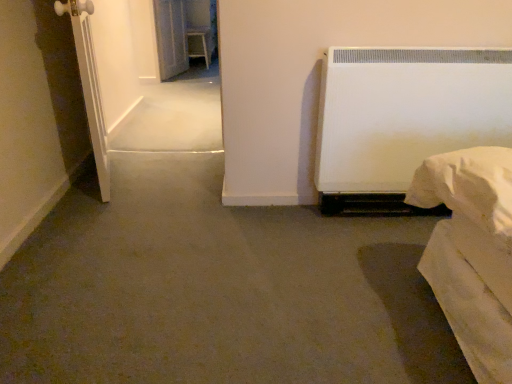
Question: Is transparent glass screen door at upper left, the first screen door positioned from the top, with white matte screen door at left, placed as the first screen door when sorted from front to back?

Choices:
 (A) yes
 (B) no

Answer: (B)

Question: Considering the relative sizes of transparent glass screen door at upper left, the first screen door positioned from the top, and white matte screen door at left, the second screen door when ordered from top to bottom, in the image provided, is transparent glass screen door at upper left, the first screen door positioned from the top, shorter than white matte screen door at left, the second screen door when ordered from top to bottom,?

Choices:
 (A) yes
 (B) no

Answer: (A)

Question: Is transparent glass screen door at upper left, which appears as the second screen door when ordered from the bottom, closer to the viewer compared to white matte screen door at left, placed as the first screen door when sorted from front to back?

Choices:
 (A) yes
 (B) no

Answer: (B)

Question: From the image's perspective, is transparent glass screen door at upper left, which is the 1th screen door from back to front, on top of white matte screen door at left, the second screen door when ordered from top to bottom?

Choices:
 (A) yes
 (B) no

Answer: (A)

Question: From a real-world perspective, is transparent glass screen door at upper left, which appears as the second screen door when ordered from the bottom, located beneath white matte screen door at left, placed as the first screen door when sorted from front to back?

Choices:
 (A) no
 (B) yes

Answer: (B)

Question: Considering the relative positions of transparent glass screen door at upper left, which appears as the second screen door when ordered from the bottom, and white matte screen door at left, placed as the first screen door when sorted from front to back, in the image provided, is transparent glass screen door at upper left, which appears as the second screen door when ordered from the bottom, behind white matte screen door at left, placed as the first screen door when sorted from front to back,?

Choices:
 (A) yes
 (B) no

Answer: (A)

Question: From a real-world perspective, is white matte screen door at left, placed as the first screen door when sorted from bottom to top, positioned under transparent glass screen door at upper left, which is the 1th screen door from back to front, based on gravity?

Choices:
 (A) no
 (B) yes

Answer: (A)

Question: From a real-world perspective, does white matte screen door at left, placed as the first screen door when sorted from bottom to top, stand above transparent glass screen door at upper left, which is the 1th screen door from back to front?

Choices:
 (A) yes
 (B) no

Answer: (A)

Question: Can we say white matte screen door at left, placed as the first screen door when sorted from bottom to top, lies outside transparent glass screen door at upper left, the first screen door positioned from the top?

Choices:
 (A) no
 (B) yes

Answer: (B)

Question: Can you confirm if white matte screen door at left, placed as the first screen door when sorted from bottom to top, is shorter than transparent glass screen door at upper left, which appears as the second screen door when ordered from the bottom?

Choices:
 (A) no
 (B) yes

Answer: (A)

Question: Considering the relative sizes of white matte screen door at left, the second screen door when ordered from top to bottom, and transparent glass screen door at upper left, which appears as the second screen door when ordered from the bottom, in the image provided, is white matte screen door at left, the second screen door when ordered from top to bottom, bigger than transparent glass screen door at upper left, which appears as the second screen door when ordered from the bottom,?

Choices:
 (A) no
 (B) yes

Answer: (B)

Question: Considering the relative positions of white matte screen door at left, placed as the first screen door when sorted from front to back, and transparent glass screen door at upper left, the first screen door positioned from the top, in the image provided, is white matte screen door at left, placed as the first screen door when sorted from front to back, in front of transparent glass screen door at upper left, the first screen door positioned from the top,?

Choices:
 (A) yes
 (B) no

Answer: (A)

Question: Would you say transparent glass screen door at upper left, the first screen door positioned from the top, is to the left or to the right of white matte screen door at left, placed as the first screen door when sorted from bottom to top, in the picture?

Choices:
 (A) left
 (B) right

Answer: (A)